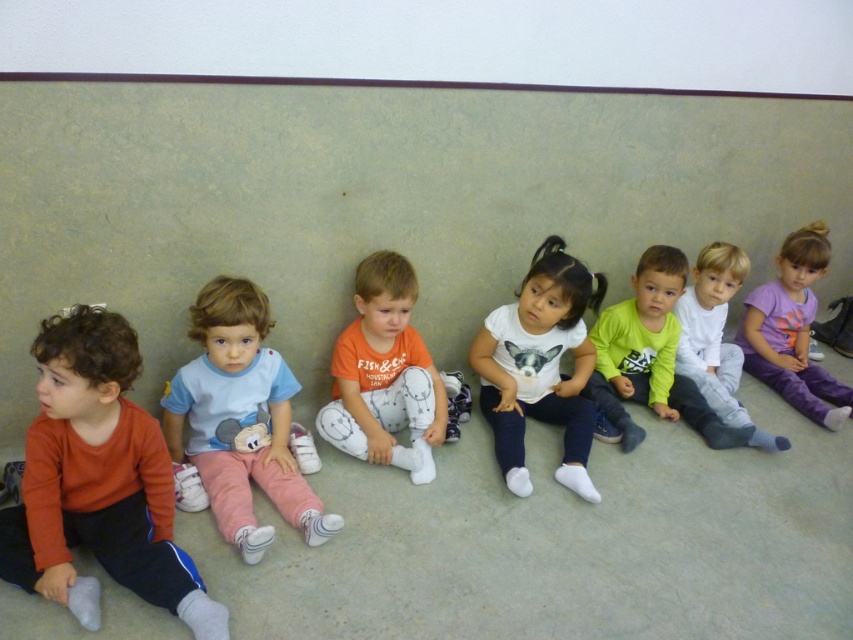
Question: Does light blue cotton shirt at center lie behind purple cotton shirt at right?

Choices:
 (A) no
 (B) yes

Answer: (A)

Question: Is matte orange shirt at left to the right of white matte shirt at center from the viewer's perspective?

Choices:
 (A) no
 (B) yes

Answer: (A)

Question: Which object is the closest to the purple cotton shirt at right?

Choices:
 (A) orange cotton shirt at center
 (B) light blue cotton shirt at center
 (C) green matte shirt at center

Answer: (C)

Question: Considering the relative positions of orange cotton shirt at center and green matte shirt at center in the image provided, where is orange cotton shirt at center located with respect to green matte shirt at center?

Choices:
 (A) right
 (B) left

Answer: (B)

Question: Which of these objects is positioned closest to the green matte shirt at center?

Choices:
 (A) orange cotton shirt at center
 (B) purple cotton shirt at right
 (C) matte orange shirt at left
 (D) light blue cotton shirt at center

Answer: (B)

Question: Estimate the real-world distances between objects in this image. Which object is farther from the purple cotton shirt at right?

Choices:
 (A) orange cotton shirt at center
 (B) light blue cotton shirt at center

Answer: (B)